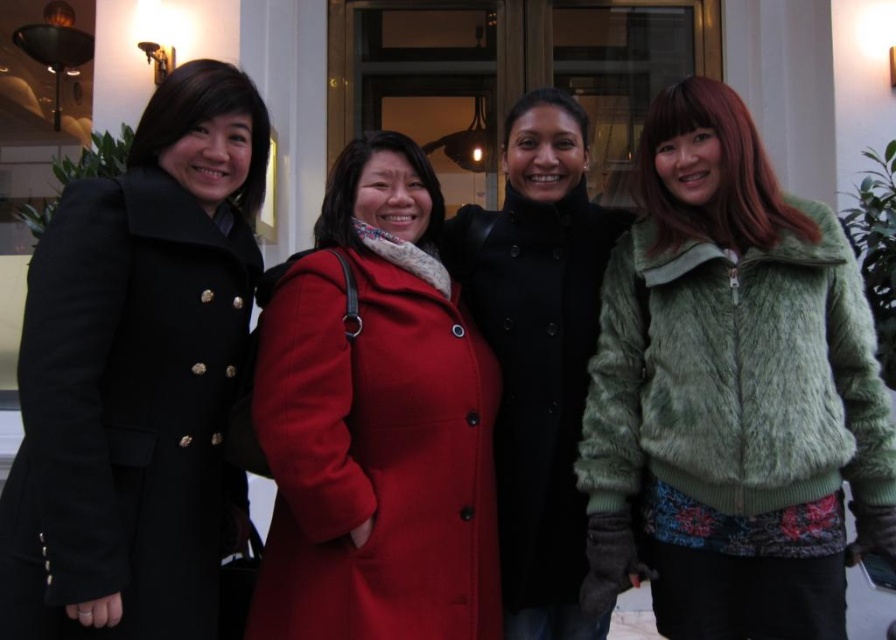
Is matte black coat at left smaller than matte woolen coat at center?

Actually, matte black coat at left might be larger than matte woolen coat at center.

In the scene shown: Which is above, matte black coat at left or matte woolen coat at center?

matte black coat at left is above.

Is point (199, 186) positioned in front of point (441, 509)?

Yes, it is in front of point (441, 509).

Identify the location of matte black coat at left. (136, 376).

Does green furry jacket at right have a lesser height compared to matte woolen coat at center?

Incorrect, green furry jacket at right's height does not fall short of matte woolen coat at center's.

Which is more to the right, green furry jacket at right or matte woolen coat at center?

From the viewer's perspective, green furry jacket at right appears more on the right side.

This screenshot has height=640, width=896. I want to click on green furry jacket at right, so click(730, 392).

Between green furry jacket at right and matte black coat at left, which one appears on the right side from the viewer's perspective?

Positioned to the right is green furry jacket at right.

Consider the image. Is green furry jacket at right wider than matte black coat at left?

Correct, the width of green furry jacket at right exceeds that of matte black coat at left.

This screenshot has height=640, width=896. Describe the element at coordinates (730, 392) in the screenshot. I see `green furry jacket at right` at that location.

Where is `green furry jacket at right`? Image resolution: width=896 pixels, height=640 pixels. green furry jacket at right is located at coordinates (730, 392).